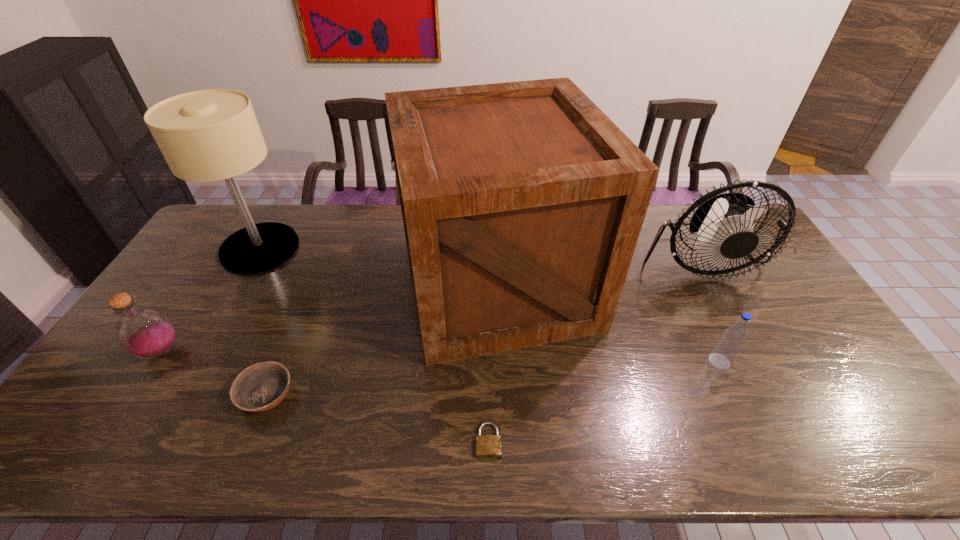
Find the location of a particular element. This screenshot has width=960, height=540. vacant region between the box and the table lamp is located at coordinates (379, 266).

Image resolution: width=960 pixels, height=540 pixels. Find the location of `unoccupied position between the fifth object from right to left and the water bottle`. unoccupied position between the fifth object from right to left and the water bottle is located at coordinates (492, 378).

The width and height of the screenshot is (960, 540). Identify the location of free point between the water bottle and the padlock. (604, 401).

Identify the location of empty location between the shortest object and the bowl. Image resolution: width=960 pixels, height=540 pixels. (377, 418).

Locate which object is the sixth closest to the shortest object. Please provide its 2D coordinates. Your answer should be formatted as a tuple, i.e. [(x, y)], where the tuple contains the x and y coordinates of a point satisfying the conditions above.

[(145, 333)]

Image resolution: width=960 pixels, height=540 pixels. I want to click on object that ranks as the fourth closest to the fifth shortest object, so click(262, 386).

This screenshot has width=960, height=540. What are the coordinates of `vacant space that satisfies the following two spatial constraints: 1. on the front side of the box; 2. on the right side of the water bottle` in the screenshot? It's located at (501, 361).